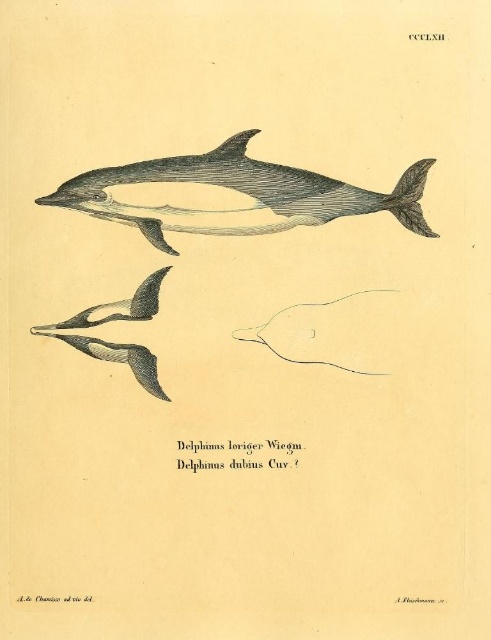
Based on the scene description, can you determine if the gray ink dolphin at center is placed above or below the gray matte dolphin fin at lower left?

The gray ink dolphin at center is positioned over gray matte dolphin fin at lower left, so it is above the fin.

Consider the image. You are an art conservator working on this illustration. You need to place a protective glass sheet over the image. The glass sheet must cover both the gray ink dolphin at center and the gray textured dolphin at lower left without overlapping any other parts of the illustration. What is the minimum width of the glass sheet required in centimeters?

The gray ink dolphin at center is 31.00 centimeters away from the gray textured dolphin at lower left. To cover both without overlapping other parts, the minimum width of the glass sheet should be at least 31.00 centimeters.

You are an art conservator examining the illustration. You notice a small point marked at coordinates (x=242, y=193). Which animal in the image does this point likely belong to?

The point at coordinates (x=242, y=193) corresponds to the gray ink dolphin at center.